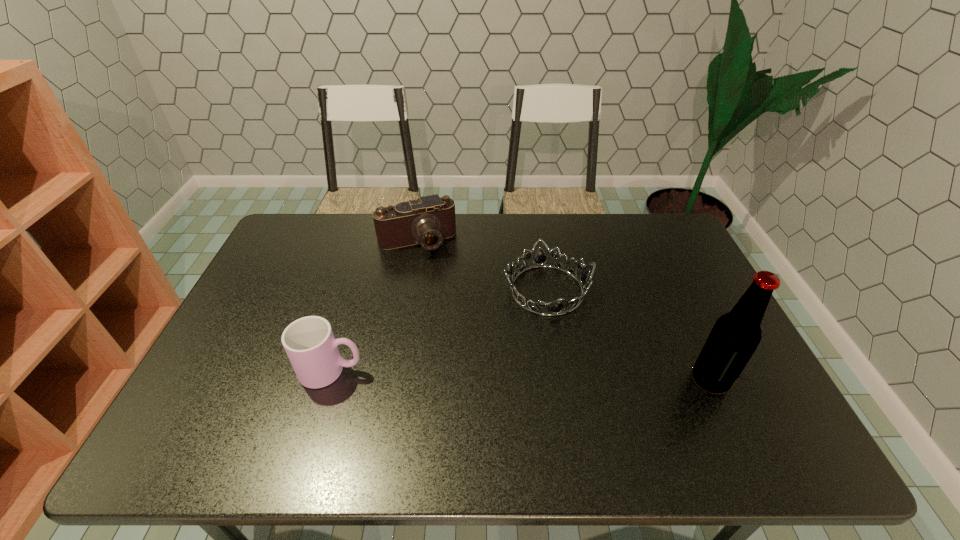
Where is `free spot on the desktop that is between the cup and the rightmost object and is positioned on the front-facing side of the tiara`? The width and height of the screenshot is (960, 540). free spot on the desktop that is between the cup and the rightmost object and is positioned on the front-facing side of the tiara is located at coordinates (575, 377).

The width and height of the screenshot is (960, 540). What are the coordinates of `vacant space on the desktop that is between the cup and the beer bottle and is positioned on the front-facing side of the camera` in the screenshot? It's located at (468, 374).